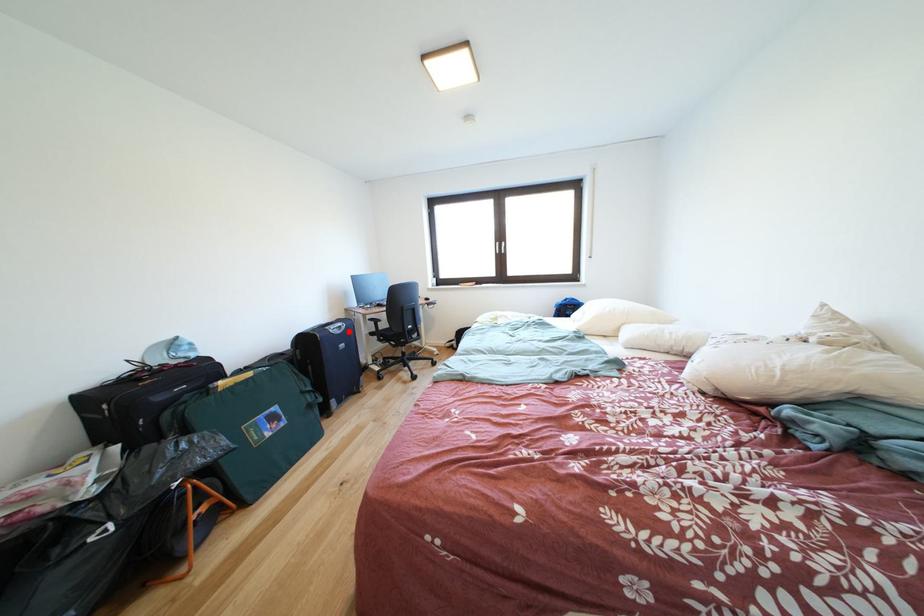
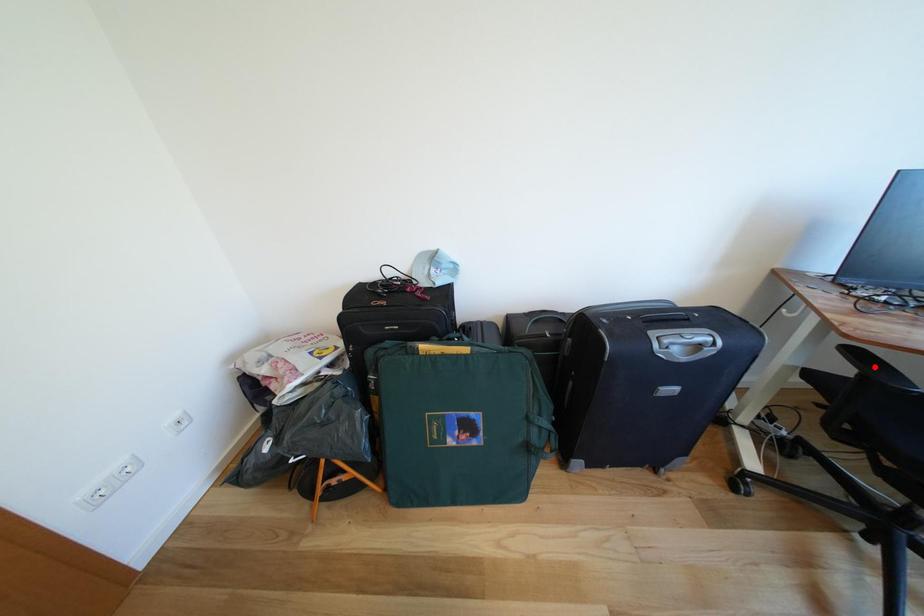
I am providing you with two images of the same scene from different viewpoints. A red point is marked on the first image and another point is marked on the second image. Do the highlighted points in image1 and image2 indicate the same real-world spot?

No